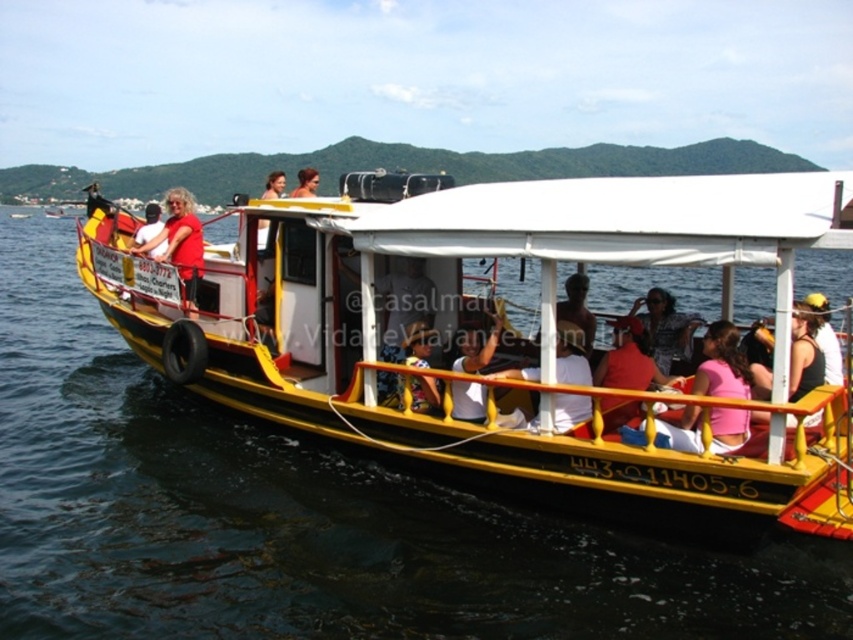
You are standing at the back of the boat and want to walk to the front. There are two points marked on the boat deck. Which point should you head towards first, point (345,349) or point (178,212)?

You should head towards point (345,349) first because it is in front of point (178,212), so it is closer to the front of the boat.

You are standing on the dock and see the boat with the registration number 4430114056. There is a specific point marked at coordinates point (461, 422) on the boat. If you want to throw a lifebuoy to that point, and the lifebuoy can travel 10 meters, will it reach the point?

The distance between you and point (461, 422) is 9.54 meters, which is within the lifebuoy range of 10 meters. Therefore, the lifebuoy can reach the point.

You are a tour guide standing on the dock. You see the yellow matte boat at center and the matte red shirt at left. A tourist asks if they can walk from the dock to the boat without getting their red shirt wet. The dock is 5 meters long. Can they make it?

The yellow matte boat at center and the matte red shirt at left are 4.61 meters apart. Since the dock is 5 meters long, the tourist can walk from the dock to the boat without getting their red shirt wet as the distance is within the dock length.